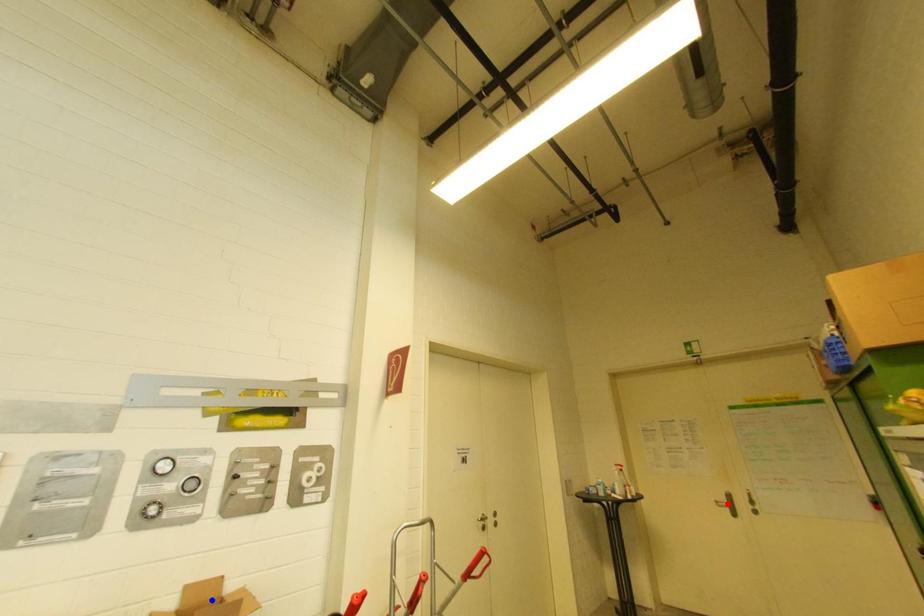
Question: In the image, two points are highlighted. Which point is nearer to the camera? Reply with the corresponding letter.

Choices:
 (A) blue point
 (B) red point

Answer: (A)